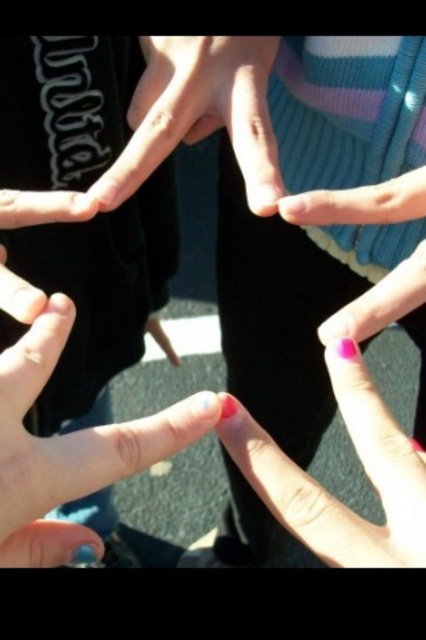
Question: Which of the following is the farthest from the observer?

Choices:
 (A) smooth skin hand at center
 (B) pink polished nail at center
 (C) smooth skin hand at lower left

Answer: (A)

Question: Can you confirm if smooth skin hand at lower left is smaller than pink polished nail at center?

Choices:
 (A) yes
 (B) no

Answer: (B)

Question: Does smooth skin hand at lower left have a larger size compared to pink polished nail at center?

Choices:
 (A) no
 (B) yes

Answer: (B)

Question: Which point is closer to the camera?

Choices:
 (A) smooth skin hand at lower left
 (B) pink polished nail at center
 (C) smooth skin hand at center

Answer: (B)

Question: Which of the following is the closest to the observer?

Choices:
 (A) smooth skin hand at lower left
 (B) pink polished nail at center
 (C) smooth skin hand at center

Answer: (B)

Question: Can you confirm if pink polished nail at center is positioned to the right of smooth skin hand at center?

Choices:
 (A) no
 (B) yes

Answer: (B)